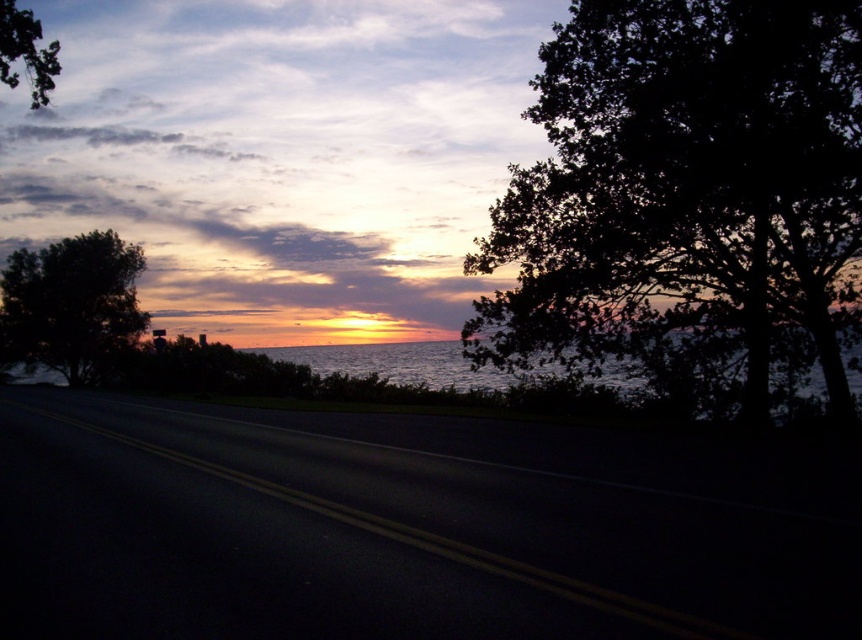
Is green leafy tree at left wider than shimmering silver water at center?

No.

Does green leafy tree at left appear on the right side of shimmering silver water at center?

Incorrect, green leafy tree at left is not on the right side of shimmering silver water at center.

Is point (52, 330) closer to camera compared to point (506, 378)?

Yes, point (52, 330) is closer to viewer.

The width and height of the screenshot is (862, 640). I want to click on green leafy tree at left, so click(70, 301).

Is point (800, 90) in front of point (30, 81)?

Yes, it is.

Which is below, dark green leafy tree at upper right or green leafy tree at upper left?

dark green leafy tree at upper right

Find the location of a particular element. This screenshot has width=862, height=640. dark green leafy tree at upper right is located at coordinates (688, 193).

Between dark green leafy tree at upper right and shimmering silver water at center, which one is positioned lower?

shimmering silver water at center is below.

Between dark green leafy tree at upper right and shimmering silver water at center, which one has less height?

shimmering silver water at center is shorter.

Is point (565, 100) less distant than point (492, 387)?

Yes, point (565, 100) is in front of point (492, 387).

Locate an element on the screen. This screenshot has height=640, width=862. dark green leafy tree at upper right is located at coordinates (688, 193).